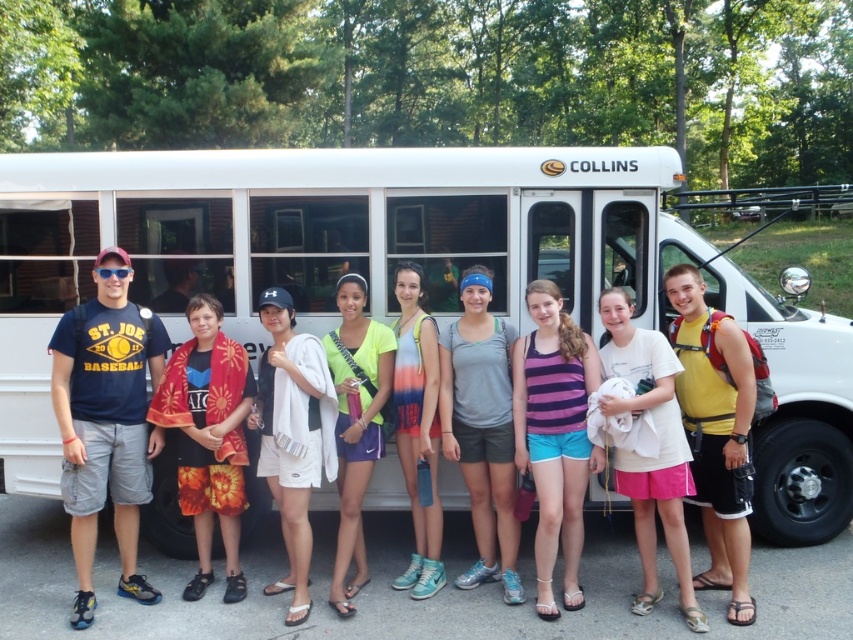
Consider the image. Can you confirm if purple striped tank top at center is shorter than gray matte tank top at center?

Indeed, purple striped tank top at center has a lesser height compared to gray matte tank top at center.

Is purple striped tank top at center smaller than gray matte tank top at center?

Indeed, purple striped tank top at center has a smaller size compared to gray matte tank top at center.

Is point (549, 342) closer to viewer compared to point (511, 444)?

Yes, point (549, 342) is in front of point (511, 444).

I want to click on purple striped tank top at center, so click(x=554, y=435).

What do you see at coordinates (316, 243) in the screenshot? The width and height of the screenshot is (853, 640). I see `white matte school bus at center` at bounding box center [316, 243].

Who is lower down, white matte school bus at center or purple striped tank top at center?

purple striped tank top at center

Who is more distant from viewer, (165,515) or (553,502)?

Positioned behind is point (165,515).

At what (x,y) coordinates should I click in order to perform the action: click on white matte school bus at center. Please return your answer as a coordinate pair (x, y). Looking at the image, I should click on (316, 243).

Between point (94, 240) and point (195, 348), which one is positioned in front?

Point (195, 348)

Can you confirm if white matte school bus at center is thinner than floral towel at center?

Incorrect, white matte school bus at center's width is not less than floral towel at center's.

Which is in front, point (438, 161) or point (198, 365)?

Positioned in front is point (198, 365).

You are a GUI agent. You are given a task and a screenshot of the screen. Output one action in this format:
    pyautogui.click(x=<x>, y=<y>)
    Task: Click on the white matte school bus at center
    The image size is (853, 640).
    Given the screenshot: What is the action you would take?
    pyautogui.click(x=316, y=243)